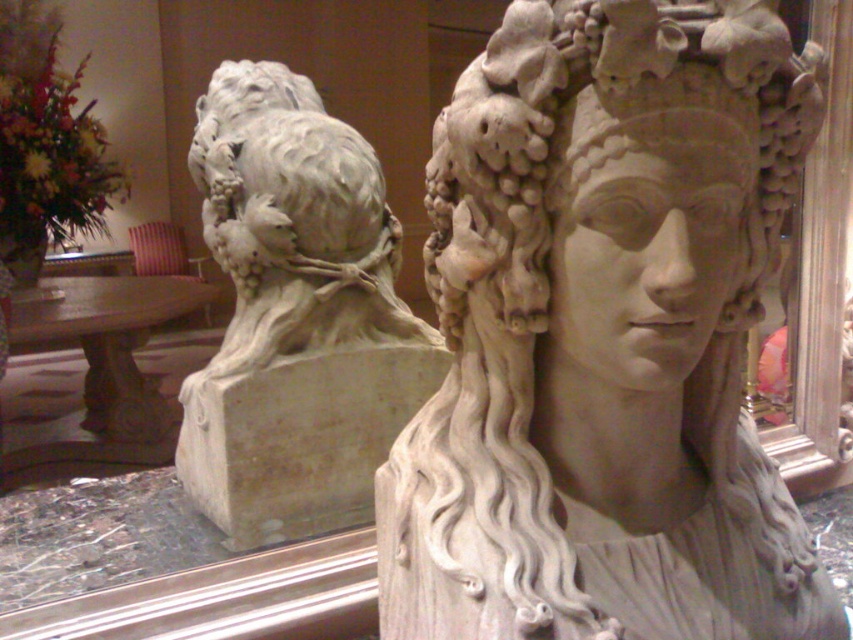
You are an art curator planning to move the white stone sculpture at center and the matte stone lion at upper left to a new exhibition space. The new space has a 1.5 meter wide entrance. Can both sculptures fit through the entrance if placed side by side?

The white stone sculpture at center is larger than the matte stone lion at upper left. Since the entrance is 1.5 meters wide, the combined width of both sculptures must be less than or equal to 1.5 meters. However, without knowing their exact widths, it is impossible to determine if they will fit together through the entrance.

You are standing in a museum and see the image. There is a point at coordinates (605,337). Which object in the scene does this point belong to?

The point at coordinates (605,337) is on the white stone sculpture at center.